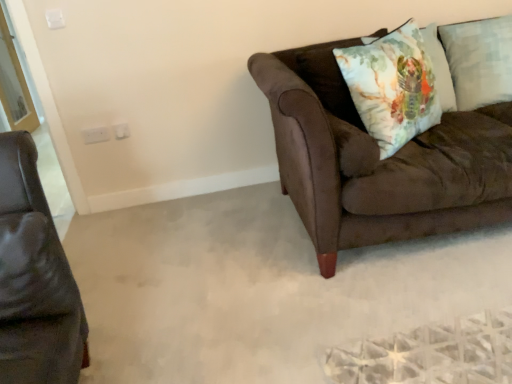
What is the approximate width of light blue textured pillow at upper right, the first pillow positioned from the right?

light blue textured pillow at upper right, the first pillow positioned from the right, is 27.36 centimeters wide.

The height and width of the screenshot is (384, 512). Describe the element at coordinates (479, 60) in the screenshot. I see `light blue textured pillow at upper right, the first pillow positioned from the right` at that location.

This screenshot has height=384, width=512. What do you see at coordinates (392, 86) in the screenshot?
I see `watercolor fabric pillow at upper right` at bounding box center [392, 86].

What do you see at coordinates (258, 289) in the screenshot? The image size is (512, 384). I see `brown leather armchair at left` at bounding box center [258, 289].

Find the location of a particular element. brown leather armchair at left is located at coordinates (258, 289).

The width and height of the screenshot is (512, 384). What do you see at coordinates (34, 278) in the screenshot? I see `matte black leather couch at left, marked as the second studio couch in a right-to-left arrangement` at bounding box center [34, 278].

Locate an element on the screen. The height and width of the screenshot is (384, 512). suede brown couch at right, positioned as the first studio couch in back-to-front order is located at coordinates (377, 161).

Where is `transparent glass screen door at upper left`? transparent glass screen door at upper left is located at coordinates (14, 84).

In the scene shown: Is matte black leather couch at left, the first studio couch in the left-to-right sequence, aimed at floral cotton cushion at upper right, placed as the second pillow when sorted from right to left?

No, matte black leather couch at left, the first studio couch in the left-to-right sequence, is not aimed at floral cotton cushion at upper right, placed as the second pillow when sorted from right to left.

Considering the relative positions of matte black leather couch at left, which is counted as the first studio couch, starting from the front, and floral cotton cushion at upper right, which is the first pillow in left-to-right order, in the image provided, is matte black leather couch at left, which is counted as the first studio couch, starting from the front, to the right of floral cotton cushion at upper right, which is the first pillow in left-to-right order, from the viewer's perspective?

No.

In the image, is matte black leather couch at left, which is counted as the first studio couch, starting from the front, positioned in front of or behind floral cotton cushion at upper right, which is the first pillow in left-to-right order?

Clearly, matte black leather couch at left, which is counted as the first studio couch, starting from the front, is in front of floral cotton cushion at upper right, which is the first pillow in left-to-right order.

From a real-world perspective, is matte black leather couch at left, which appears as the 2th studio couch when viewed from the back, over floral cotton cushion at upper right, placed as the second pillow when sorted from right to left?

No, from a real-world perspective, matte black leather couch at left, which appears as the 2th studio couch when viewed from the back, is not over floral cotton cushion at upper right, placed as the second pillow when sorted from right to left

Does transparent glass screen door at upper left have a smaller size compared to suede brown couch at right, which is the 2th studio couch in front-to-back order?

Yes.

Is the depth of transparent glass screen door at upper left greater than that of suede brown couch at right, which ranks as the 1th studio couch in right-to-left order?

Yes, the depth of transparent glass screen door at upper left is greater than that of suede brown couch at right, which ranks as the 1th studio couch in right-to-left order.

From the image's perspective, between transparent glass screen door at upper left and suede brown couch at right, the 2th studio couch positioned from the left, which one is located above?

From the image's view, transparent glass screen door at upper left is above.

Is transparent glass screen door at upper left to the left or to the right of suede brown couch at right, the 2th studio couch positioned from the left, in the image?

transparent glass screen door at upper left is positioned on suede brown couch at right, the 2th studio couch positioned from the left,'s left side.

Would you say watercolor fabric pillow at upper right is outside light blue textured pillow at upper right, the first pillow positioned from the right?

Indeed, watercolor fabric pillow at upper right is completely outside light blue textured pillow at upper right, the first pillow positioned from the right.

Is point (421, 115) in front of point (448, 44)?

Yes, point (421, 115) is closer to viewer.

Considering the relative positions of watercolor fabric pillow at upper right and light blue textured pillow at upper right, which is the second pillow from left to right, in the image provided, is watercolor fabric pillow at upper right to the left of light blue textured pillow at upper right, which is the second pillow from left to right, from the viewer's perspective?

Indeed, watercolor fabric pillow at upper right is positioned on the left side of light blue textured pillow at upper right, which is the second pillow from left to right.

Is matte black leather couch at left, which is counted as the first studio couch, starting from the front, surrounded by transparent glass screen door at upper left?

No, matte black leather couch at left, which is counted as the first studio couch, starting from the front, is located outside of transparent glass screen door at upper left.

How many degrees apart are the facing directions of transparent glass screen door at upper left and matte black leather couch at left, which appears as the 2th studio couch when viewed from the back?

The angle between the facing direction of transparent glass screen door at upper left and the facing direction of matte black leather couch at left, which appears as the 2th studio couch when viewed from the back, is 88.8 degrees.

Is there a large distance between transparent glass screen door at upper left and matte black leather couch at left, which is counted as the first studio couch, starting from the front?

Yes.

Considering the sizes of objects transparent glass screen door at upper left and matte black leather couch at left, marked as the second studio couch in a right-to-left arrangement, in the image provided, who is bigger, transparent glass screen door at upper left or matte black leather couch at left, marked as the second studio couch in a right-to-left arrangement,?

With larger size is transparent glass screen door at upper left.

From the picture: Is floral cotton cushion at upper right, placed as the second pillow when sorted from right to left, positioned in front of watercolor fabric pillow at upper right?

No, floral cotton cushion at upper right, placed as the second pillow when sorted from right to left, is behind watercolor fabric pillow at upper right.

Is point (445, 94) positioned after point (338, 64)?

Yes, point (445, 94) is farther from viewer.

From the image's perspective, is floral cotton cushion at upper right, which is the first pillow in left-to-right order, above watercolor fabric pillow at upper right?

Indeed, from the image's perspective, floral cotton cushion at upper right, which is the first pillow in left-to-right order, is shown above watercolor fabric pillow at upper right.

At what (x,y) coordinates should I click in order to perform the action: click on pillow that is the 1st one below the watercolor fabric pillow at upper right (from a real-world perspective). Please return your answer as a coordinate pair (x, y). Looking at the image, I should click on (439, 68).

Between point (426, 140) and point (337, 274), which one is positioned in front?

Positioned in front is point (337, 274).

Is suede brown couch at right, positioned as the first studio couch in back-to-front order, to the left or to the right of brown leather armchair at left in the image?

Based on their positions, suede brown couch at right, positioned as the first studio couch in back-to-front order, is located to the right of brown leather armchair at left.

Considering the relative sizes of suede brown couch at right, which ranks as the 1th studio couch in right-to-left order, and brown leather armchair at left in the image provided, is suede brown couch at right, which ranks as the 1th studio couch in right-to-left order, bigger than brown leather armchair at left?

Yes, suede brown couch at right, which ranks as the 1th studio couch in right-to-left order, is bigger than brown leather armchair at left.

From a real-world perspective, starting from the floral cotton cushion at upper right, which is the first pillow in left-to-right order, which studio couch is the 1st one below it? Please provide its 2D coordinates.

[(34, 278)]

Is floral cotton cushion at upper right, which is the first pillow in left-to-right order, with matte black leather couch at left, marked as the second studio couch in a right-to-left arrangement?

No, floral cotton cushion at upper right, which is the first pillow in left-to-right order, is not with matte black leather couch at left, marked as the second studio couch in a right-to-left arrangement.

Who is shorter, floral cotton cushion at upper right, which is the first pillow in left-to-right order, or matte black leather couch at left, marked as the second studio couch in a right-to-left arrangement?

Standing shorter between the two is matte black leather couch at left, marked as the second studio couch in a right-to-left arrangement.

Image resolution: width=512 pixels, height=384 pixels. I want to click on pillow that is the 2nd object above the matte black leather couch at left, which is counted as the first studio couch, starting from the front (from a real-world perspective), so click(x=439, y=68).

Locate an element on the screen. The width and height of the screenshot is (512, 384). screen door on the left of suede brown couch at right, the 2th studio couch positioned from the left is located at coordinates (14, 84).

Which object lies further to the anchor point suede brown couch at right, positioned as the first studio couch in back-to-front order, transparent glass screen door at upper left or light blue textured pillow at upper right, the first pillow positioned from the right?

Among the two, transparent glass screen door at upper left is located further to suede brown couch at right, positioned as the first studio couch in back-to-front order.

Based on their spatial positions, is brown leather armchair at left or watercolor fabric pillow at upper right closer to matte black leather couch at left, which appears as the 2th studio couch when viewed from the back?

brown leather armchair at left is closer to matte black leather couch at left, which appears as the 2th studio couch when viewed from the back.

When comparing their distances from matte black leather couch at left, which is counted as the first studio couch, starting from the front, does brown leather armchair at left or suede brown couch at right, the 2th studio couch positioned from the left, seem closer?

Based on the image, brown leather armchair at left appears to be nearer to matte black leather couch at left, which is counted as the first studio couch, starting from the front.

Estimate the real-world distances between objects in this image. Which object is further from brown leather armchair at left, light blue textured pillow at upper right, which is the second pillow from left to right, or watercolor fabric pillow at upper right?

light blue textured pillow at upper right, which is the second pillow from left to right, is positioned further to the anchor brown leather armchair at left.

When comparing their distances from transparent glass screen door at upper left, does brown leather armchair at left or suede brown couch at right, which is the 2th studio couch in front-to-back order, seem further?

suede brown couch at right, which is the 2th studio couch in front-to-back order, is further to transparent glass screen door at upper left.

From the picture: When comparing their distances from watercolor fabric pillow at upper right, does brown leather armchair at left or transparent glass screen door at upper left seem closer?

The object closer to watercolor fabric pillow at upper right is brown leather armchair at left.

From the image, which object appears to be farther from brown leather armchair at left, floral cotton cushion at upper right, which is the first pillow in left-to-right order, or suede brown couch at right, the 2th studio couch positioned from the left?

floral cotton cushion at upper right, which is the first pillow in left-to-right order, lies further to brown leather armchair at left than the other object.

Based on the photo, estimate the real-world distances between objects in this image. Which object is closer to transparent glass screen door at upper left, floral cotton cushion at upper right, which is the first pillow in left-to-right order, or light blue textured pillow at upper right, the first pillow positioned from the right?

floral cotton cushion at upper right, which is the first pillow in left-to-right order, lies closer to transparent glass screen door at upper left than the other object.

Image resolution: width=512 pixels, height=384 pixels. What are the coordinates of `studio couch between brown leather armchair at left and light blue textured pillow at upper right, which is the second pillow from left to right, in the horizontal direction` in the screenshot? It's located at (377, 161).

Where is `throw pillow located between suede brown couch at right, positioned as the first studio couch in back-to-front order, and floral cotton cushion at upper right, which is the first pillow in left-to-right order, in the depth direction`? This screenshot has width=512, height=384. throw pillow located between suede brown couch at right, positioned as the first studio couch in back-to-front order, and floral cotton cushion at upper right, which is the first pillow in left-to-right order, in the depth direction is located at coordinates (392, 86).

Where is `pillow between brown leather armchair at left and light blue textured pillow at upper right, the first pillow positioned from the right`? The width and height of the screenshot is (512, 384). pillow between brown leather armchair at left and light blue textured pillow at upper right, the first pillow positioned from the right is located at coordinates (439, 68).

The image size is (512, 384). I want to click on pillow between transparent glass screen door at upper left and suede brown couch at right, which ranks as the 1th studio couch in right-to-left order, from left to right, so click(439, 68).